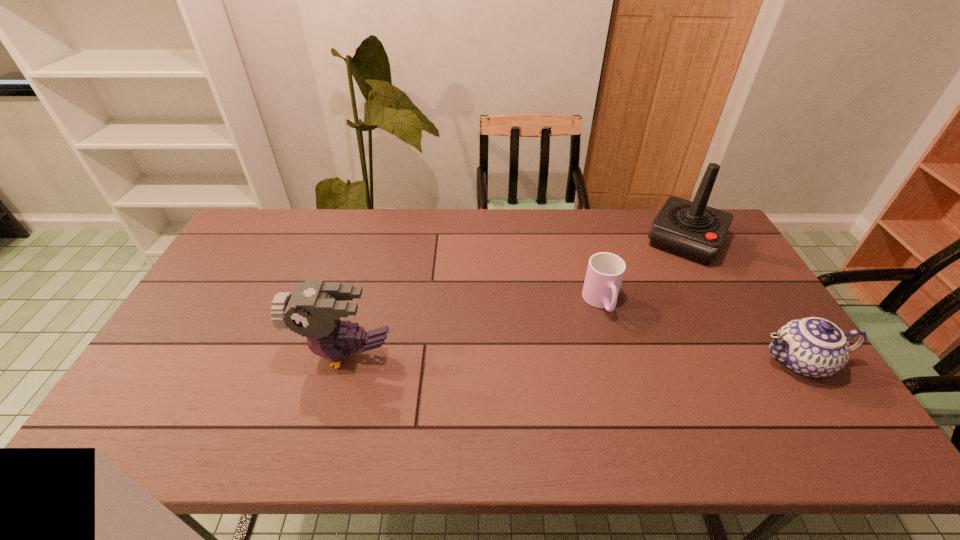
Locate an element on the screen. This screenshot has width=960, height=540. vacant region located 0.260m from the spout of the chinaware is located at coordinates (653, 361).

Identify the location of blank space located from the spout of the chinaware. The width and height of the screenshot is (960, 540). [x=660, y=361].

Identify the location of free space located 0.090m from the spout of the chinaware. (717, 361).

What are the coordinates of `free space located 0.060m with the handle on the side of the second farthest object` in the screenshot? It's located at (614, 338).

The height and width of the screenshot is (540, 960). Identify the location of vacant space located with the handle on the side of the second farthest object. (613, 335).

This screenshot has height=540, width=960. Find the location of `vacant space situated with the handle on the side of the second farthest object`. vacant space situated with the handle on the side of the second farthest object is located at coordinates (619, 349).

Locate an element on the screen. The height and width of the screenshot is (540, 960). vacant area situated on the front-facing side of the joystick is located at coordinates (668, 272).

Locate an element on the screen. free location located 0.320m on the front-facing side of the joystick is located at coordinates (639, 325).

This screenshot has height=540, width=960. Identify the location of blank area located 0.100m on the front-facing side of the joystick. (663, 281).

The width and height of the screenshot is (960, 540). I want to click on object that is at the far edge, so click(x=692, y=230).